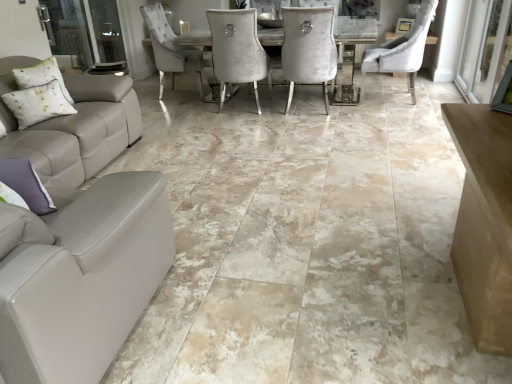
This screenshot has height=384, width=512. In order to click on clear glass screen door at left, acting as the 1th screen door starting from the left in this screenshot , I will do `click(85, 31)`.

How much space does transparent glass screen door at right, acting as the 2th screen door starting from the left, occupy vertically?

transparent glass screen door at right, acting as the 2th screen door starting from the left, is 1.03 meters tall.

The image size is (512, 384). Identify the location of transparent glass screen door at right, placed as the 1th screen door when sorted from right to left. pyautogui.click(x=484, y=49).

You are a GUI agent. You are given a task and a screenshot of the screen. Output one action in this format:
    pyautogui.click(x=<x>, y=<y>)
    Task: Click on the velvet beige chair at center, the first chair when ordered from right to left
    
    Given the screenshot: What is the action you would take?
    402,50

What do you see at coordinates (308, 49) in the screenshot? This screenshot has width=512, height=384. I see `velvet white chair at center, placed as the first chair when sorted from left to right` at bounding box center [308, 49].

This screenshot has height=384, width=512. Describe the element at coordinates (37, 104) in the screenshot. I see `white textured pillow at left, the 2th pillow in the right-to-left sequence` at that location.

Describe the element at coordinates (26, 184) in the screenshot. I see `purple fabric pillow at lower left, positioned as the first pillow in bottom-to-top order` at that location.

The width and height of the screenshot is (512, 384). What are the coordinates of `clear glass screen door at left, which appears as the second screen door when viewed from the right` in the screenshot? It's located at (85, 31).

Is point (73, 42) farther from camera compared to point (315, 38)?

Yes, point (73, 42) is farther from viewer.

Measure the distance between clear glass screen door at left, acting as the 1th screen door starting from the left, and velvet white chair at center, arranged as the second chair when viewed from the right.

The distance of clear glass screen door at left, acting as the 1th screen door starting from the left, from velvet white chair at center, arranged as the second chair when viewed from the right, is 8.36 feet.

From a real-world perspective, which is physically above, clear glass screen door at left, which appears as the second screen door when viewed from the right, or velvet white chair at center, placed as the first chair when sorted from left to right?

clear glass screen door at left, which appears as the second screen door when viewed from the right.

Is clear glass screen door at left, acting as the 1th screen door starting from the left, not close to velvet white chair at center, arranged as the second chair when viewed from the right?

→ Yes, clear glass screen door at left, acting as the 1th screen door starting from the left, and velvet white chair at center, arranged as the second chair when viewed from the right, are located far from each other.

From the image's perspective, count 2nd screen doors upward from the purple fabric pillow at lower left, the 2th pillow when ordered from left to right, and point to it. Please provide its 2D coordinates.

[(85, 31)]

From a real-world perspective, between clear glass screen door at left, which appears as the second screen door when viewed from the right, and purple fabric pillow at lower left, marked as the 1th pillow in a front-to-back arrangement, who is vertically lower?

clear glass screen door at left, which appears as the second screen door when viewed from the right, from a real-world perspective.

How different are the orientations of clear glass screen door at left, which appears as the second screen door when viewed from the right, and purple fabric pillow at lower left, positioned as the first pillow in bottom-to-top order, in degrees?

84.1 degrees.

Who is taller, purple fabric pillow at lower left, the 2th pillow when ordered from left to right, or white textured pillow at left, the 1th pillow when ordered from top to bottom?

With more height is white textured pillow at left, the 1th pillow when ordered from top to bottom.

Is purple fabric pillow at lower left, positioned as the first pillow in bottom-to-top order, next to white textured pillow at left, the 2th pillow in the right-to-left sequence, and touching it?

No, purple fabric pillow at lower left, positioned as the first pillow in bottom-to-top order, is not beside white textured pillow at left, the 2th pillow in the right-to-left sequence.

From the picture: Based on their sizes in the image, would you say purple fabric pillow at lower left, the 2th pillow when ordered from left to right, is bigger or smaller than white textured pillow at left, the 2th pillow in the right-to-left sequence?

Clearly, purple fabric pillow at lower left, the 2th pillow when ordered from left to right, is smaller in size than white textured pillow at left, the 2th pillow in the right-to-left sequence.

Does purple fabric pillow at lower left, the 2th pillow when ordered from left to right, appear on the right side of white textured pillow at left, the 2th pillow when ordered from bottom to top?

Indeed, purple fabric pillow at lower left, the 2th pillow when ordered from left to right, is positioned on the right side of white textured pillow at left, the 2th pillow when ordered from bottom to top.

Is transparent glass screen door at right, placed as the 1th screen door when sorted from right to left, bigger than clear glass screen door at left, which appears as the second screen door when viewed from the right?

Yes.

Considering the points (504, 13) and (121, 62), which point is in front, point (504, 13) or point (121, 62)?

The point (504, 13) is more forward.

Is transparent glass screen door at right, placed as the 1th screen door when sorted from right to left, to the right of clear glass screen door at left, which appears as the second screen door when viewed from the right, from the viewer's perspective?

Indeed, transparent glass screen door at right, placed as the 1th screen door when sorted from right to left, is positioned on the right side of clear glass screen door at left, which appears as the second screen door when viewed from the right.

Could you tell me if purple fabric pillow at lower left, positioned as the first pillow in bottom-to-top order, is turned towards transparent glass screen door at right, placed as the 1th screen door when sorted from right to left?

No.

Consider the image. How many degrees apart are the facing directions of purple fabric pillow at lower left, which is counted as the second pillow, starting from the top, and transparent glass screen door at right, placed as the 1th screen door when sorted from right to left?

95.8 degrees.

Does purple fabric pillow at lower left, positioned as the first pillow in bottom-to-top order, contain transparent glass screen door at right, acting as the 2th screen door starting from the left?

Definitely not — transparent glass screen door at right, acting as the 2th screen door starting from the left, is not inside purple fabric pillow at lower left, positioned as the first pillow in bottom-to-top order.

Does purple fabric pillow at lower left, the 2th pillow when ordered from left to right, appear on the right side of transparent glass screen door at right, placed as the 1th screen door when sorted from right to left?

No.

Is the position of white textured pillow at left, positioned as the 1th pillow in left-to-right order, less distant than that of velvet beige chair at center, acting as the 2th chair starting from the left?

Yes, the depth of white textured pillow at left, positioned as the 1th pillow in left-to-right order, is less than that of velvet beige chair at center, acting as the 2th chair starting from the left.

Considering the relative sizes of white textured pillow at left, the second pillow viewed from the front, and velvet beige chair at center, the first chair when ordered from right to left, in the image provided, is white textured pillow at left, the second pillow viewed from the front, bigger than velvet beige chair at center, the first chair when ordered from right to left,?

No.

In the image, is white textured pillow at left, the second pillow viewed from the front, on the left side or the right side of velvet beige chair at center, acting as the 2th chair starting from the left?

Based on their positions, white textured pillow at left, the second pillow viewed from the front, is located to the left of velvet beige chair at center, acting as the 2th chair starting from the left.

Is white textured pillow at left, the 1th pillow when ordered from top to bottom, situated inside velvet beige chair at center, the first chair when ordered from right to left, or outside?

The correct answer is: outside.

Considering the sizes of objects purple fabric pillow at lower left, which is counted as the second pillow, starting from the top, and velvet beige chair at center, acting as the 2th chair starting from the left, in the image provided, who is thinner, purple fabric pillow at lower left, which is counted as the second pillow, starting from the top, or velvet beige chair at center, acting as the 2th chair starting from the left,?

purple fabric pillow at lower left, which is counted as the second pillow, starting from the top.

Considering the relative positions of purple fabric pillow at lower left, positioned as the first pillow in right-to-left order, and velvet beige chair at center, acting as the 2th chair starting from the left, in the image provided, is purple fabric pillow at lower left, positioned as the first pillow in right-to-left order, to the right of velvet beige chair at center, acting as the 2th chair starting from the left, from the viewer's perspective?

No, purple fabric pillow at lower left, positioned as the first pillow in right-to-left order, is not to the right of velvet beige chair at center, acting as the 2th chair starting from the left.

Is purple fabric pillow at lower left, acting as the second pillow starting from the back, not within velvet beige chair at center, acting as the 2th chair starting from the left?

Yes, purple fabric pillow at lower left, acting as the second pillow starting from the back, is not within velvet beige chair at center, acting as the 2th chair starting from the left.

Locate an element on the screen. Image resolution: width=512 pixels, height=384 pixels. the 1st chair to the right of the clear glass screen door at left, acting as the 1th screen door starting from the left, counting from the anchor's position is located at coordinates (308, 49).

Starting from the purple fabric pillow at lower left, marked as the 1th pillow in a front-to-back arrangement, which screen door is the 2nd one behind? Please provide its 2D coordinates.

[(85, 31)]

Looking at the image, which one is located further to purple fabric pillow at lower left, marked as the 1th pillow in a front-to-back arrangement, transparent glass screen door at right, acting as the 2th screen door starting from the left, or white textured pillow at left, marked as the first pillow in a back-to-front arrangement?

transparent glass screen door at right, acting as the 2th screen door starting from the left, lies further to purple fabric pillow at lower left, marked as the 1th pillow in a front-to-back arrangement, than the other object.

Estimate the real-world distances between objects in this image. Which object is closer to purple fabric pillow at lower left, acting as the second pillow starting from the back, transparent glass screen door at right, acting as the 2th screen door starting from the left, or clear glass screen door at left, acting as the 1th screen door starting from the left?

Among the two, clear glass screen door at left, acting as the 1th screen door starting from the left, is located nearer to purple fabric pillow at lower left, acting as the second pillow starting from the back.

Based on the photo, from the image, which object appears to be farther from velvet beige chair at center, the first chair when ordered from right to left, transparent glass screen door at right, acting as the 2th screen door starting from the left, or clear glass screen door at left, which appears as the second screen door when viewed from the right?

clear glass screen door at left, which appears as the second screen door when viewed from the right, lies further to velvet beige chair at center, the first chair when ordered from right to left, than the other object.

Based on their spatial positions, is clear glass screen door at left, which appears as the second screen door when viewed from the right, or transparent glass screen door at right, placed as the 1th screen door when sorted from right to left, closer to velvet beige chair at center, acting as the 2th chair starting from the left?

transparent glass screen door at right, placed as the 1th screen door when sorted from right to left, is positioned closer to the anchor velvet beige chair at center, acting as the 2th chair starting from the left.

Based on their spatial positions, is velvet beige chair at center, the first chair when ordered from right to left, or transparent glass screen door at right, placed as the 1th screen door when sorted from right to left, closer to white textured pillow at left, the 1th pillow when ordered from top to bottom?

The object closer to white textured pillow at left, the 1th pillow when ordered from top to bottom, is velvet beige chair at center, the first chair when ordered from right to left.

Which object lies nearer to the anchor point clear glass screen door at left, acting as the 1th screen door starting from the left, velvet beige chair at center, acting as the 2th chair starting from the left, or white textured pillow at left, the 2th pillow when ordered from bottom to top?

white textured pillow at left, the 2th pillow when ordered from bottom to top, lies closer to clear glass screen door at left, acting as the 1th screen door starting from the left, than the other object.

Looking at the image, which one is located closer to white textured pillow at left, the second pillow viewed from the front, clear glass screen door at left, which appears as the second screen door when viewed from the right, or transparent glass screen door at right, placed as the 1th screen door when sorted from right to left?

clear glass screen door at left, which appears as the second screen door when viewed from the right, lies closer to white textured pillow at left, the second pillow viewed from the front, than the other object.

Estimate the real-world distances between objects in this image. Which object is further from white textured pillow at left, the second pillow viewed from the front, clear glass screen door at left, acting as the 1th screen door starting from the left, or purple fabric pillow at lower left, acting as the second pillow starting from the back?

The object further to white textured pillow at left, the second pillow viewed from the front, is clear glass screen door at left, acting as the 1th screen door starting from the left.

Locate an element on the screen. Image resolution: width=512 pixels, height=384 pixels. chair located between white textured pillow at left, the 2th pillow in the right-to-left sequence, and velvet beige chair at center, acting as the 2th chair starting from the left, in the left-right direction is located at coordinates pyautogui.click(x=308, y=49).

Image resolution: width=512 pixels, height=384 pixels. Find the location of `chair between clear glass screen door at left, acting as the 1th screen door starting from the left, and velvet beige chair at center, the first chair when ordered from right to left`. chair between clear glass screen door at left, acting as the 1th screen door starting from the left, and velvet beige chair at center, the first chair when ordered from right to left is located at coordinates (308, 49).

Identify the location of pillow between white textured pillow at left, the 2th pillow when ordered from bottom to top, and transparent glass screen door at right, placed as the 1th screen door when sorted from right to left, from left to right. (26, 184).

Find the location of `pillow located between white textured pillow at left, the 1th pillow when ordered from top to bottom, and velvet beige chair at center, acting as the 2th chair starting from the left, in the left-right direction`. pillow located between white textured pillow at left, the 1th pillow when ordered from top to bottom, and velvet beige chair at center, acting as the 2th chair starting from the left, in the left-right direction is located at coordinates (26, 184).